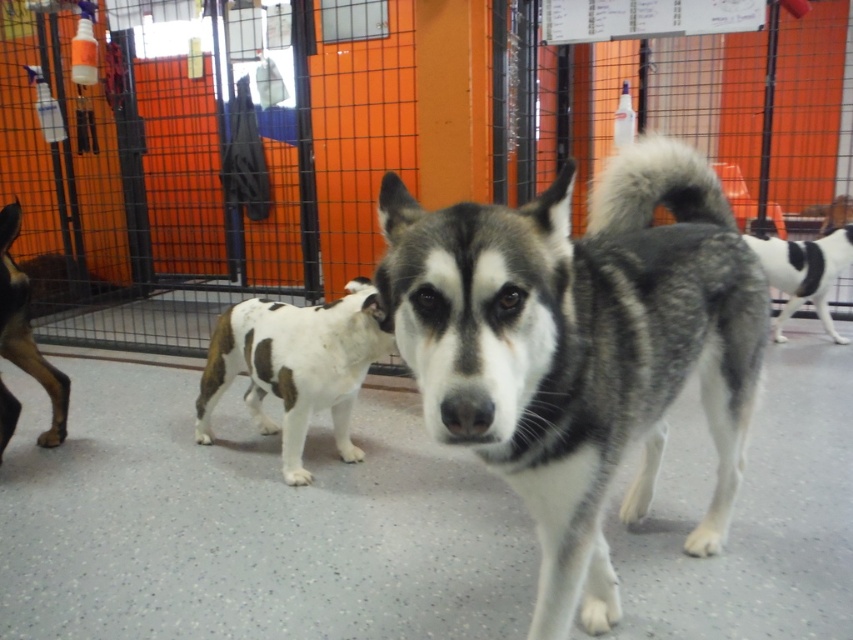
From the picture: Who is shorter, gray-white fur dog at center or spotted fur dog at center?

spotted fur dog at center is shorter.

Which is behind, point (607, 435) or point (277, 380)?

The point (277, 380) is behind.

At what (x,y) coordinates should I click in order to perform the action: click on gray-white fur dog at center. Please return your answer as a coordinate pair (x, y). This screenshot has height=640, width=853. Looking at the image, I should click on (579, 348).

Is spotted fur dog at center smaller than white and black fur at center?

Actually, spotted fur dog at center might be larger than white and black fur at center.

In the scene shown: Is spotted fur dog at center thinner than white and black fur at center?

No.

This screenshot has height=640, width=853. In order to click on spotted fur dog at center in this screenshot , I will do `click(294, 365)`.

Measure the distance from spotted fur dog at center to brown fur dog at left.

spotted fur dog at center and brown fur dog at left are 31.17 inches apart from each other.

Does spotted fur dog at center have a greater height compared to brown fur dog at left?

No.

Describe the element at coordinates (294, 365) in the screenshot. I see `spotted fur dog at center` at that location.

At what (x,y) coordinates should I click in order to perform the action: click on spotted fur dog at center. Please return your answer as a coordinate pair (x, y). Image resolution: width=853 pixels, height=640 pixels. Looking at the image, I should click on (294, 365).